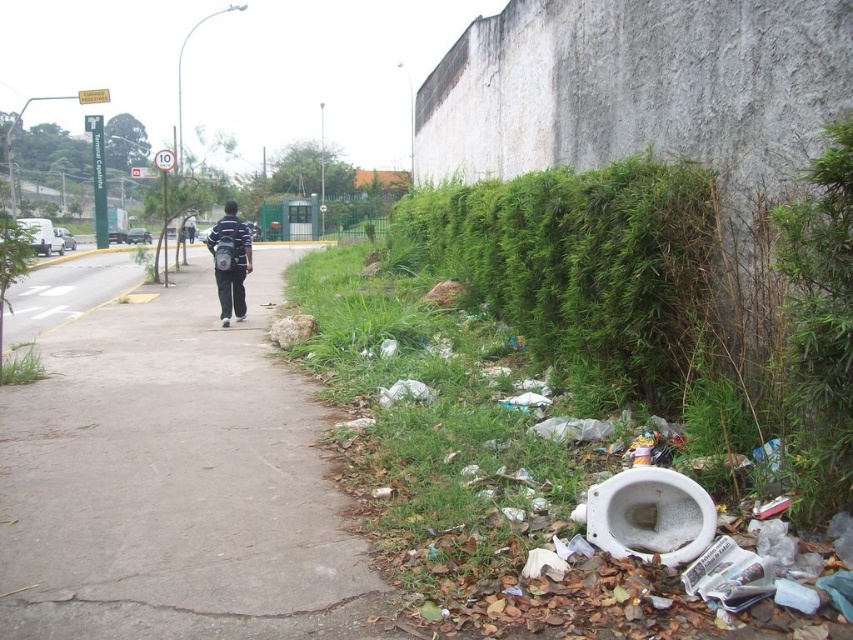
Question: Considering the real-world distances, which object is closest to the gray concrete sidewalk at center?

Choices:
 (A) white ceramic toilet at lower right
 (B) black fabric backpack at center

Answer: (A)

Question: Is white ceramic toilet at lower right to the right of black fabric backpack at center from the viewer's perspective?

Choices:
 (A) no
 (B) yes

Answer: (B)

Question: Is gray concrete sidewalk at center bigger than black fabric backpack at center?

Choices:
 (A) no
 (B) yes

Answer: (B)

Question: Among these points, which one is farthest from the camera?

Choices:
 (A) (611, 515)
 (B) (224, 292)

Answer: (B)

Question: Can you confirm if gray concrete sidewalk at center is positioned to the right of green leafy hedge at right?

Choices:
 (A) yes
 (B) no

Answer: (B)

Question: Among these points, which one is nearest to the camera?

Choices:
 (A) (136, 493)
 (B) (219, 308)
 (C) (520, 284)
 (D) (703, 492)

Answer: (D)